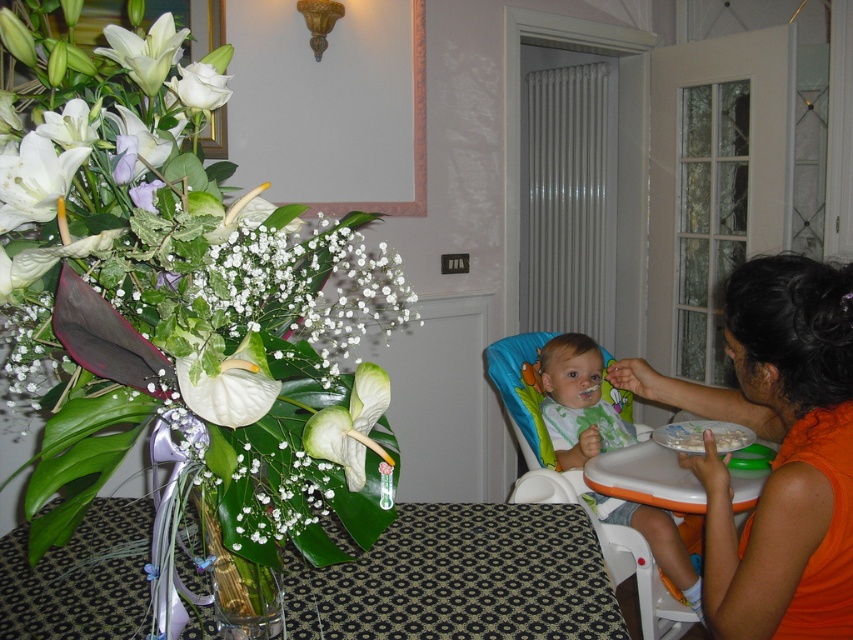
Question: Is orange fabric shirt at right behind white matte rose at upper left?

Choices:
 (A) yes
 (B) no

Answer: (A)

Question: Which point is closer to the camera?

Choices:
 (A) translucent glass vase at lower left
 (B) clear glass vase at left
 (C) white glossy flowers at left

Answer: (C)

Question: Which point is farther from the camera taking this photo?

Choices:
 (A) (209, 528)
 (B) (535, 611)
 (C) (321, 548)
 (D) (556, 346)

Answer: (D)

Question: Does matte green bib at center have a greater width compared to clear glass vase at left?

Choices:
 (A) yes
 (B) no

Answer: (A)

Question: Can you confirm if clear glass vase at left is positioned to the right of white matte rose at upper left?

Choices:
 (A) no
 (B) yes

Answer: (B)

Question: Which point is farther to the camera?

Choices:
 (A) white matte rose at upper left
 (B) matte green bib at center
 (C) translucent glass vase at lower left
 (D) clear glass vase at left

Answer: (B)